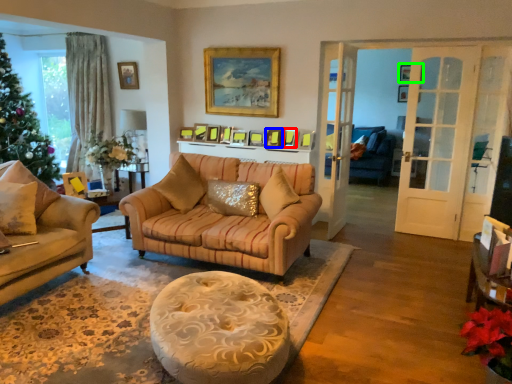
Question: Which object is positioned closest to picture frame (highlighted by a red box)? Select from picture frame (highlighted by a blue box) and picture frame (highlighted by a green box).

Choices:
 (A) picture frame
 (B) picture frame

Answer: (A)